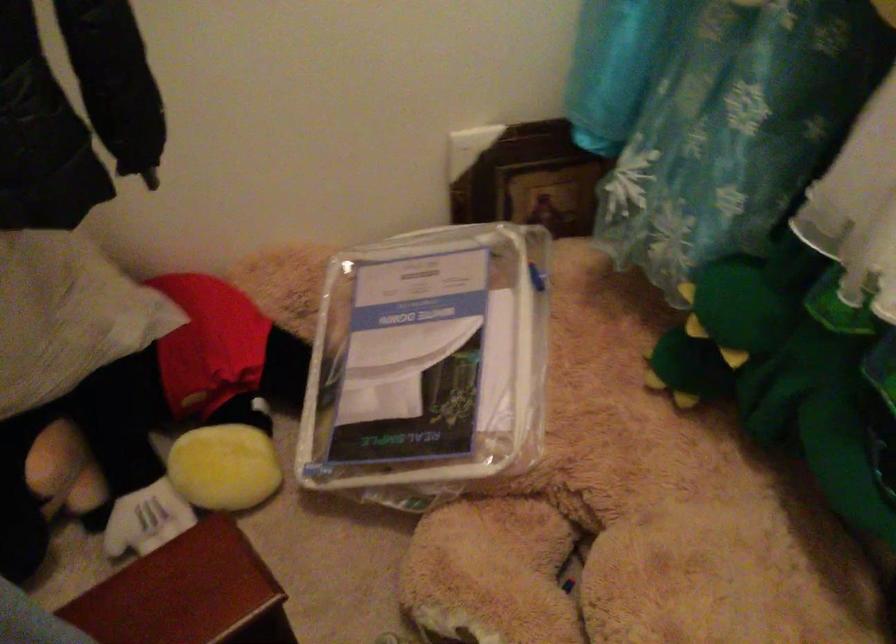
Find where to lift the green dinosaur toy. Please return your answer as a coordinate pair (x, y).

(719, 330)